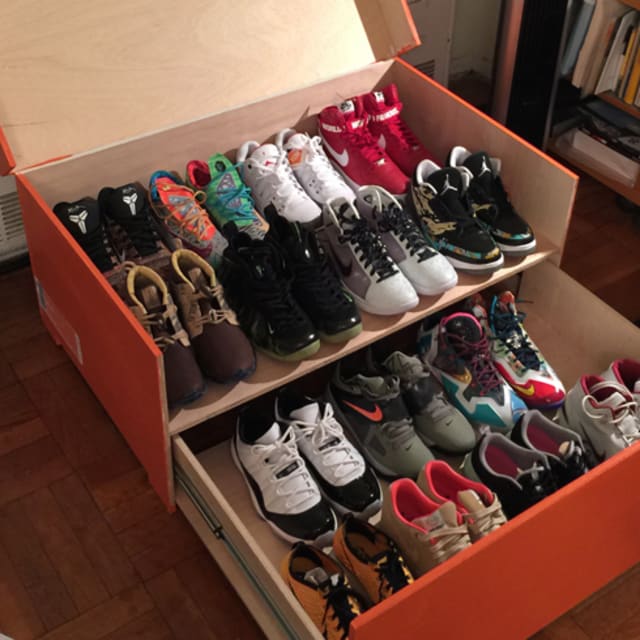
Locate an element on the screen. This screenshot has width=640, height=640. fold-out shoe box is located at coordinates (104, 330).